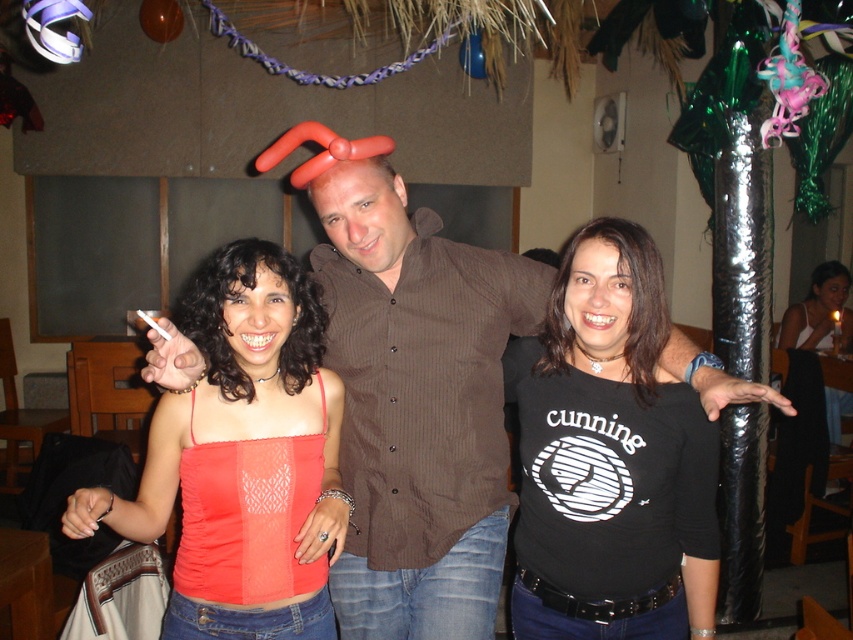
You are organizing a charity event and need to arrange two shirts on a display rack. The black matte shirt at center and the brown textured shirt at center are both to be placed side by side. Based on their sizes, which shirt should be placed on the left side to ensure the display looks balanced?

The black matte shirt at center has a lesser width compared to the brown textured shirt at center. To balance the display, place the narrower black matte shirt at center on the left and the wider brown textured shirt at center on the right.

In the image, there are three people posing. The person on the left is wearing a red sleeveless top with blue jeans, and the person in the center is wearing a brown buttoned shirt. Where is the point located at coordinates (x=418, y=408) in relation to these two individuals?

The point at (x=418, y=408) is located at the center, indicating the brown textured shirt at center.